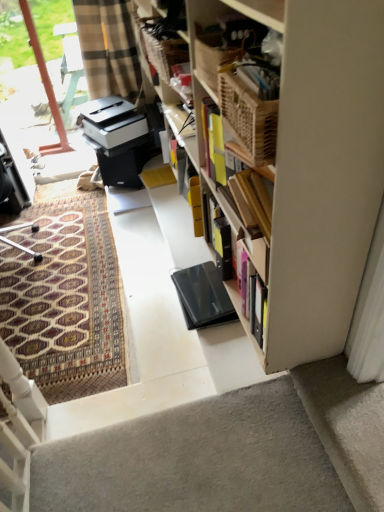
This screenshot has width=384, height=512. Identify the location of free space above gray carpet at bottom right (from a real-world perspective). (353, 415).